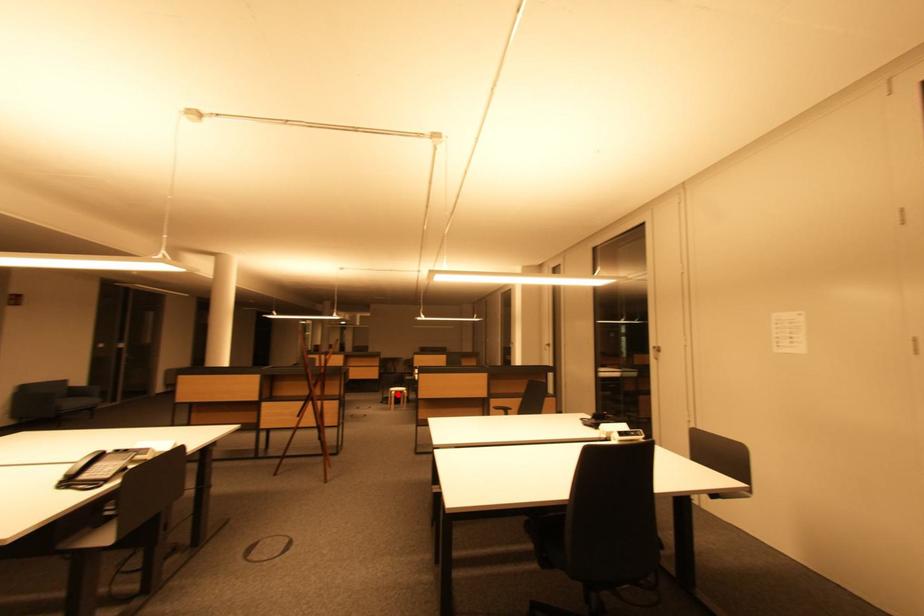
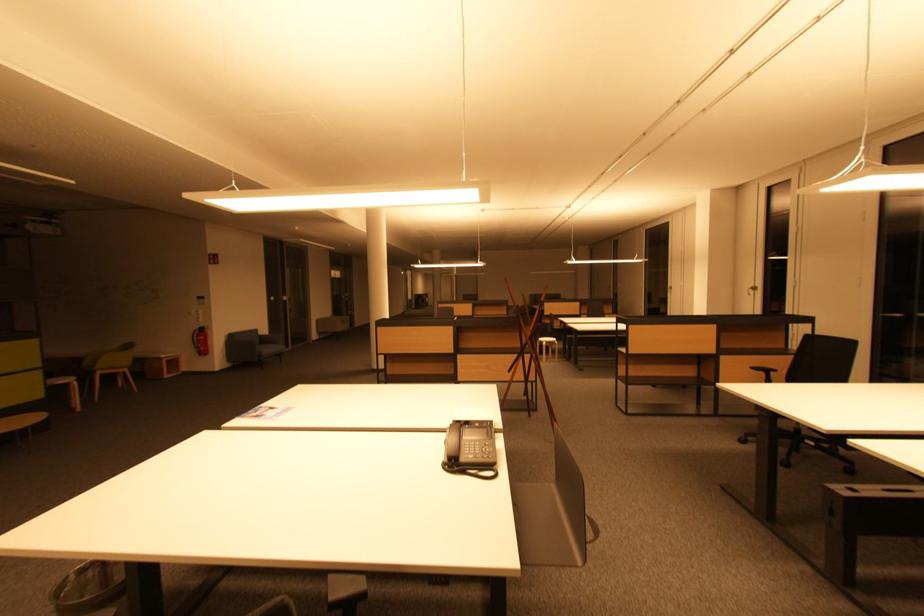
Question: I am providing you with two images of the same scene from different viewpoints. A red point is shown in image1. For the corresponding object point in image2, is it positioned nearer or farther from the camera?

Choices:
 (A) Nearer
 (B) Farther

Answer: (B)